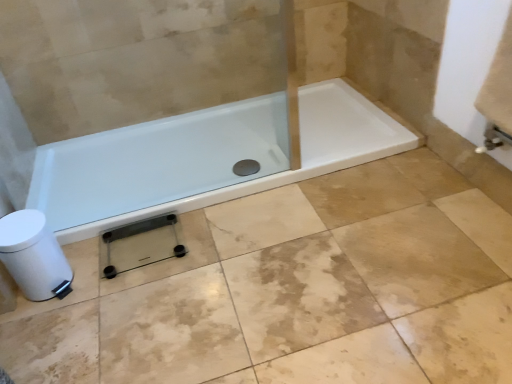
Identify the location of vacant space underneath transparent glass scale at center (from a real-world perspective). (146, 249).